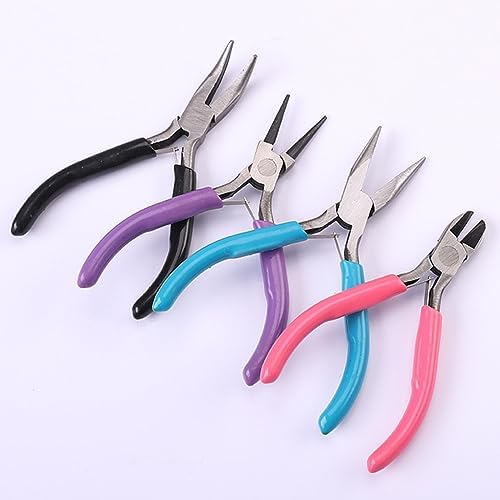
This screenshot has width=500, height=500. I want to click on craft supplies, so click(435, 264), click(359, 217), click(263, 166), click(189, 122).